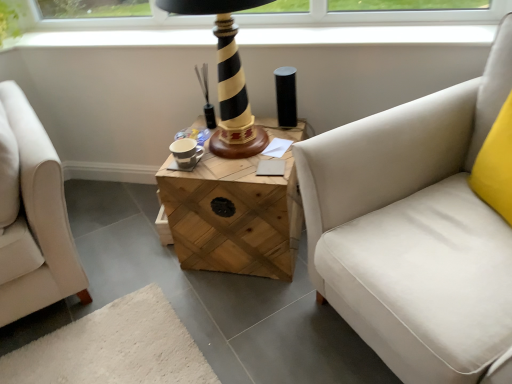
You are a GUI agent. You are given a task and a screenshot of the screen. Output one action in this format:
    pyautogui.click(x=<x>, y=<y>)
    Task: Click on the vacant region above wooden crate at center (from a real-world perspective)
    The height and width of the screenshot is (384, 512).
    Given the screenshot: What is the action you would take?
    pyautogui.click(x=242, y=152)